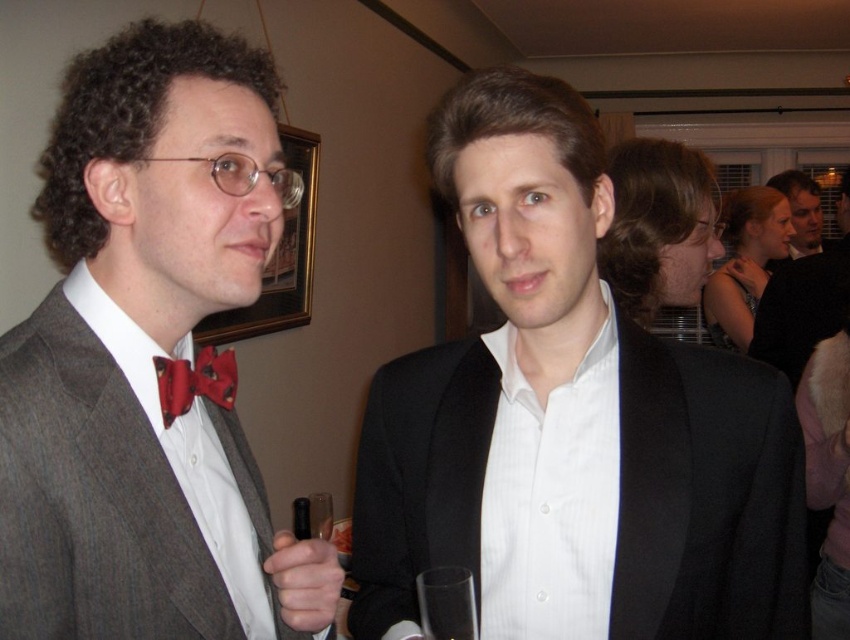
Question: Can you confirm if white shirt at center is positioned to the right of transparent glass at center?

Choices:
 (A) no
 (B) yes

Answer: (B)

Question: Which object is positioned closest to the red satin bow tie at left?

Choices:
 (A) matte black suit at upper center
 (B) white shirt at center
 (C) matte gray suit at left
 (D) black matte suit at center

Answer: (C)

Question: Is black matte suit at center closer to camera compared to transparent glass at center?

Choices:
 (A) yes
 (B) no

Answer: (B)

Question: Can you confirm if black matte suit at center is thinner than matte gray suit at left?

Choices:
 (A) no
 (B) yes

Answer: (A)

Question: Which object appears farthest from the camera in this image?

Choices:
 (A) black matte suit at center
 (B) matte black suit at upper center

Answer: (B)

Question: Which point is farther to the camera?

Choices:
 (A) matte gray suit at left
 (B) transparent glass at center
 (C) matte black suit at upper center

Answer: (C)